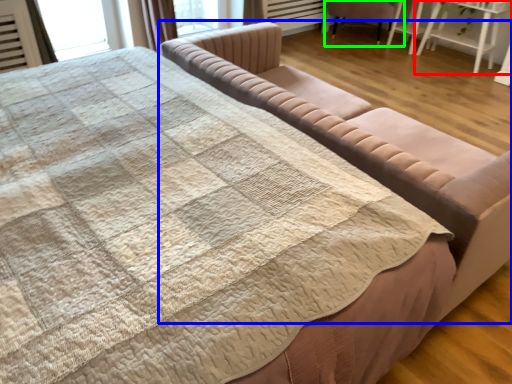
Question: Which object is positioned farthest from table (highlighted by a red box)? Select from studio couch (highlighted by a blue box) and chair (highlighted by a green box).

Choices:
 (A) studio couch
 (B) chair

Answer: (A)